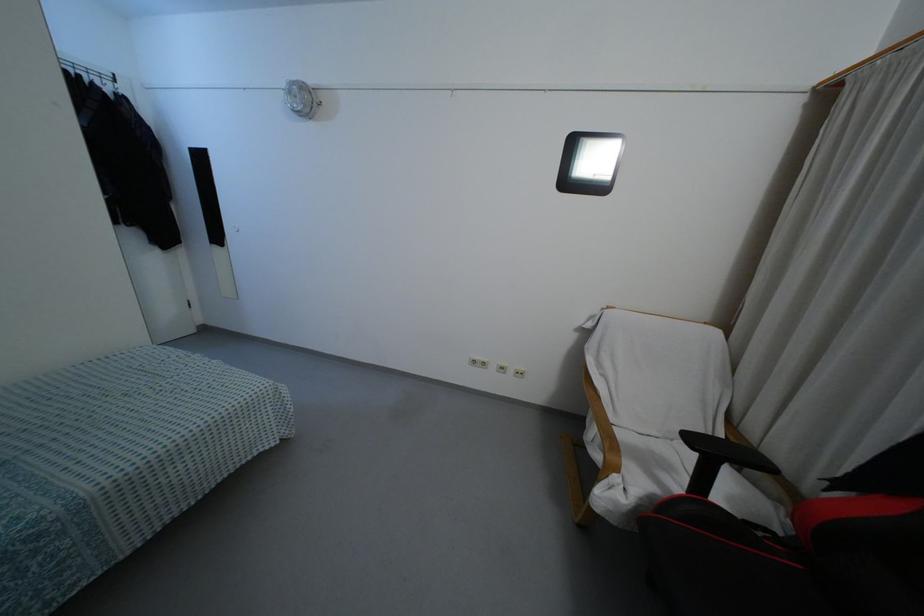
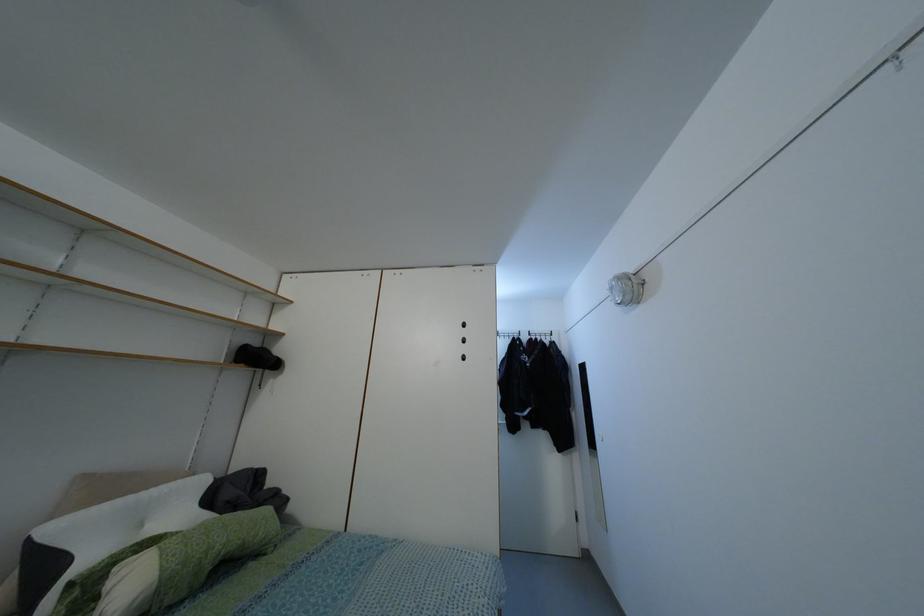
The first image is from the beginning of the video and the second image is from the end. How did the camera likely rotate when shooting the video?

The rotation direction of the camera is left-up.